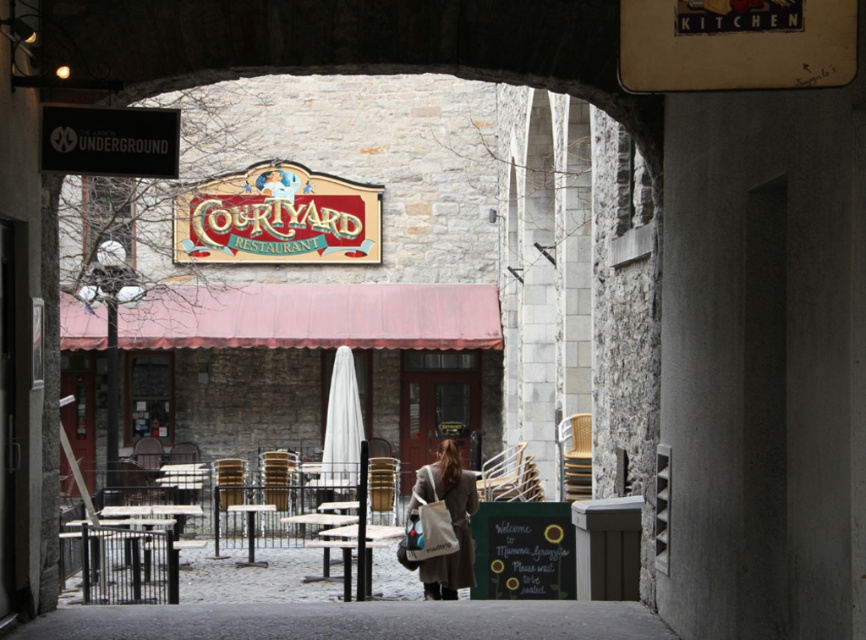
Is beige fabric bag at center closer to camera compared to metallic silver table at center?

Yes, it is in front of metallic silver table at center.

Between beige fabric bag at center and metallic silver table at center, which one is positioned lower?

metallic silver table at center is lower down.

Does point (472, 508) come in front of point (373, 532)?

Yes, point (472, 508) is in front of point (373, 532).

The height and width of the screenshot is (640, 866). I want to click on beige fabric bag at center, so click(x=451, y=522).

Who is taller, black matte sign at upper left or white fabric umbrella at center?

white fabric umbrella at center is taller.

Is point (171, 145) behind point (349, 436)?

No, it is in front of (349, 436).

Identify the location of black matte sign at upper left. This screenshot has width=866, height=640. (110, 140).

Can you confirm if white fabric umbrella at center is shorter than white wooden table at center?

No, white fabric umbrella at center is not shorter than white wooden table at center.

Is point (350, 388) behind point (249, 525)?

Yes, point (350, 388) is farther from viewer.

The width and height of the screenshot is (866, 640). I want to click on white fabric umbrella at center, so click(x=341, y=422).